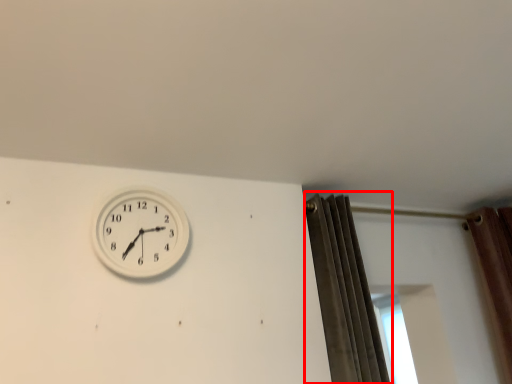
Question: From the image's perspective, considering the relative positions of curtain (annotated by the red box) and wall clock in the image provided, where is curtain (annotated by the red box) located with respect to the staircase?

Choices:
 (A) above
 (B) below

Answer: (B)